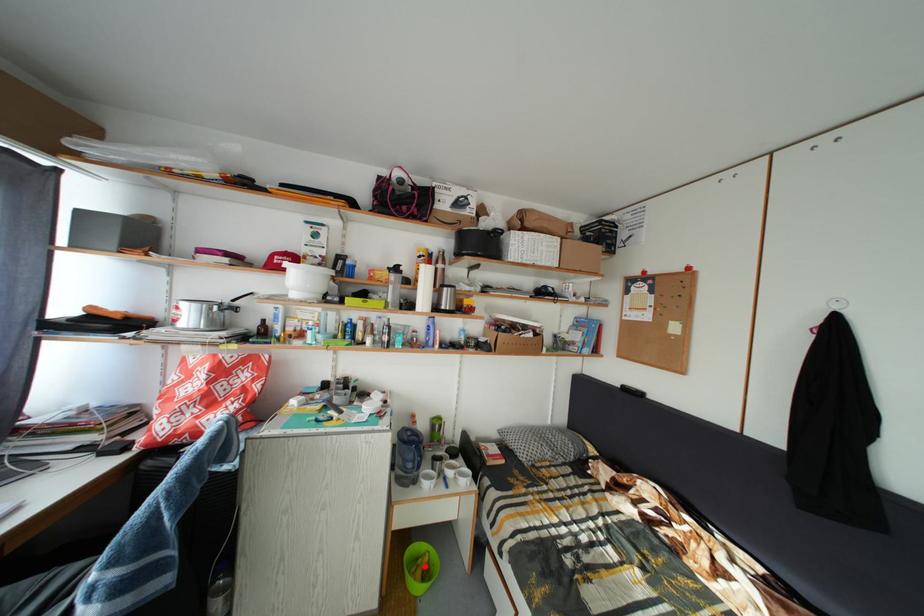
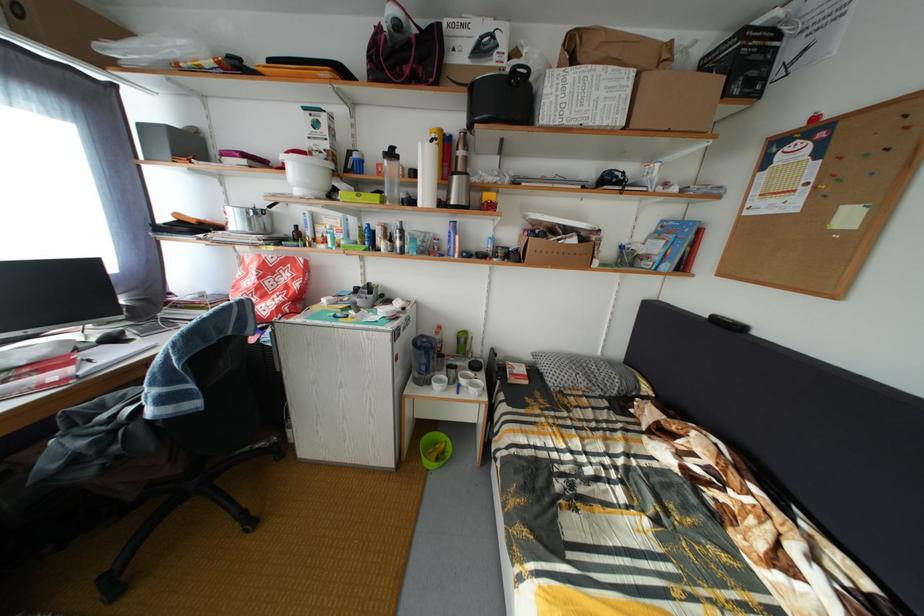
Where in the second image is the point corresponding to the highlighted location from the first image?

(444, 451)